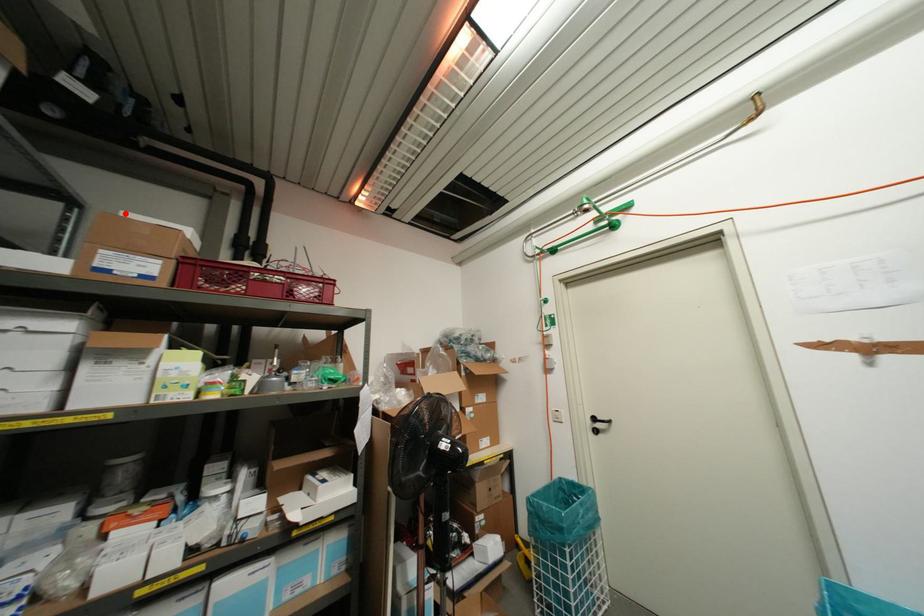
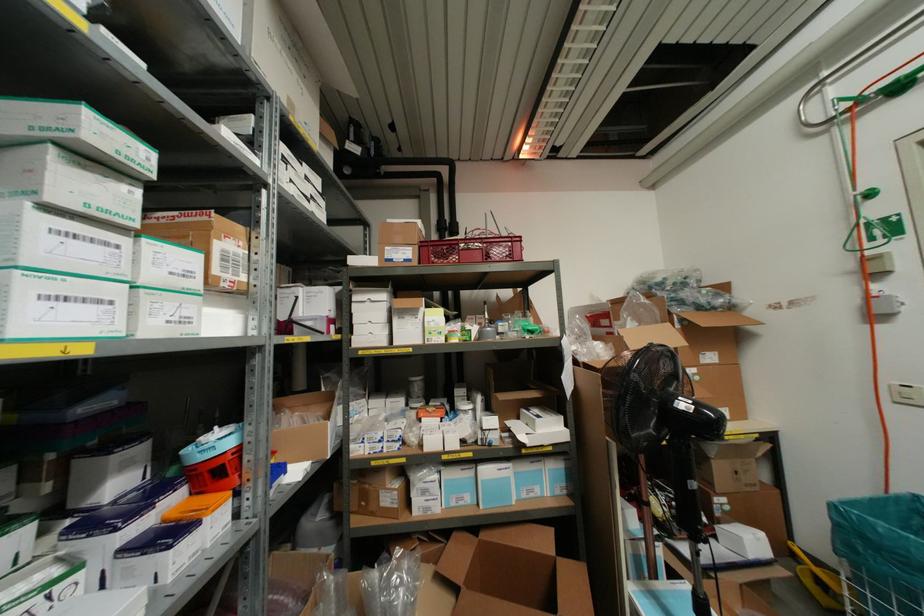
Question: I am providing you with two images of the same scene from different viewpoints. Given a red point in image1, look at the same physical point in image2. Is it:

Choices:
 (A) Closer to the viewpoint
 (B) Farther from the viewpoint

Answer: (A)